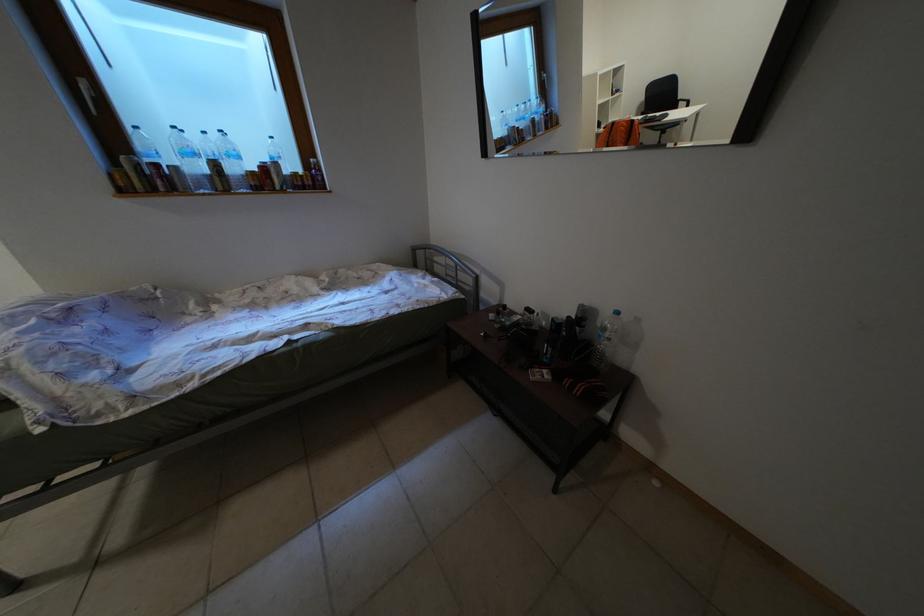
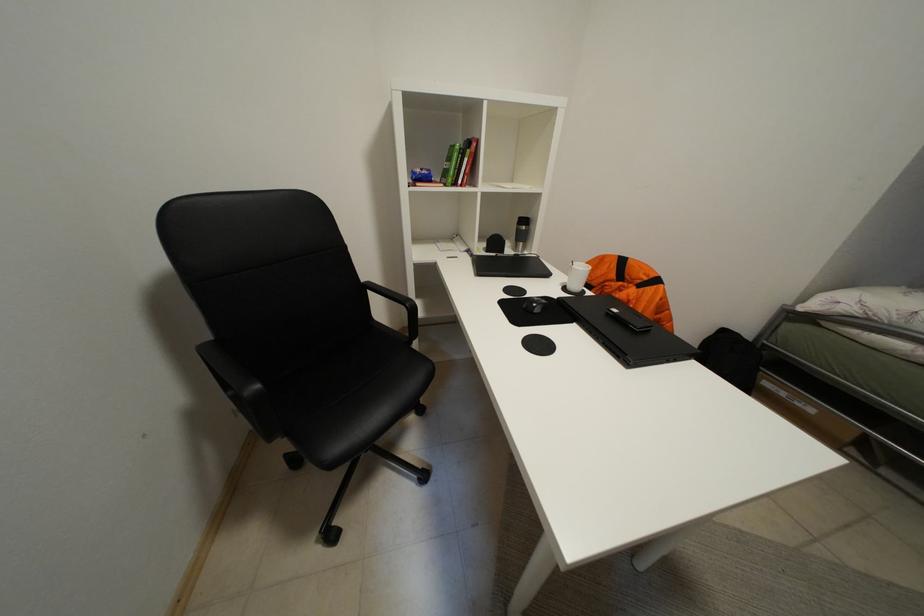
Question: In a continuous first-person perspective shot, in which direction is the camera moving?

Choices:
 (A) Left
 (B) Right
 (C) Forward
 (D) Backward

Answer: (A)